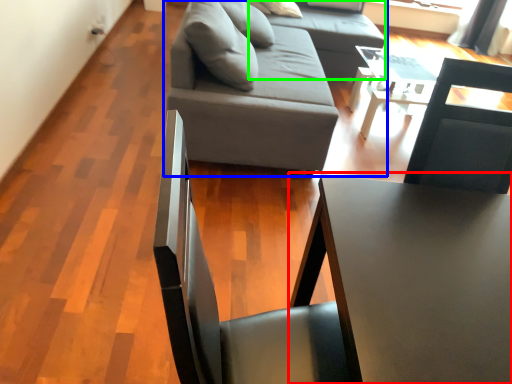
Question: Which is farther away from table (highlighted by a red box)? studio couch (highlighted by a blue box) or couch (highlighted by a green box)?

Choices:
 (A) studio couch
 (B) couch

Answer: (B)